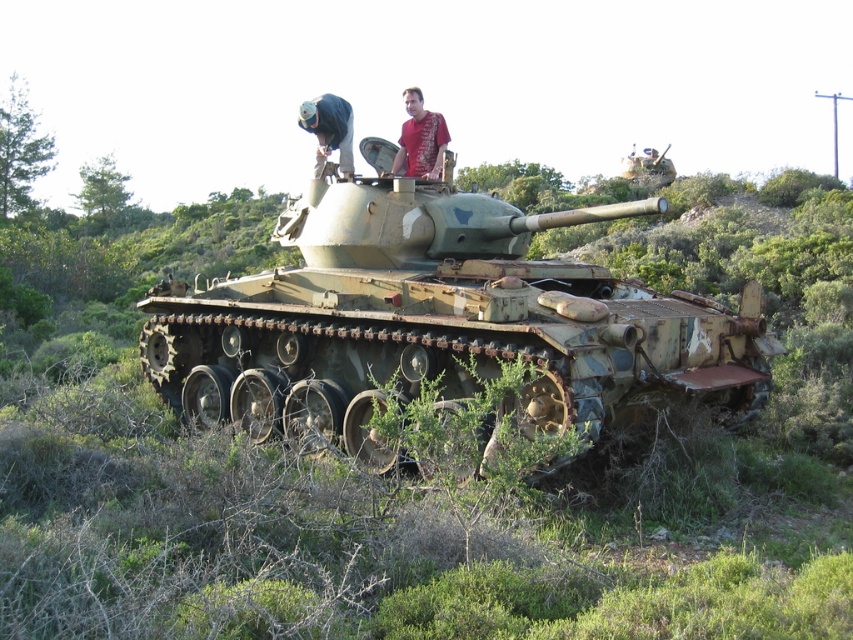
You are a photographer standing in front of the rusty metal tank at center and the red fabric shirt at upper center. You want to capture a wide shot that includes both objects. Which object should you position closer to the edge of the frame to ensure both fit in the shot?

The rusty metal tank at center is wider than the red fabric shirt at upper center. To include both in the wide shot, position the rusty metal tank at center closer to the edge of the frame so that there is enough space for the narrower red fabric shirt at upper center in the composition.

You are observing a military tank in a hilly area and notice a red fabric shirt at upper center. Where exactly is the red fabric shirt positioned in relation to the tank?

The red fabric shirt at upper center is located at point (419, 140) relative to the image frame.

You are standing at the camera position and want to reach the point marked at coordinates (630, 336). The tank is between you and that point. Can you walk around the tank to reach it?

The point marked at coordinates (630, 336) is 20.12 feet away from the camera. Since the tank is between you and the point, you would need to navigate around it. However, the description does not provide information about the tank size or path availability, so it is uncertain if you can walk around it.